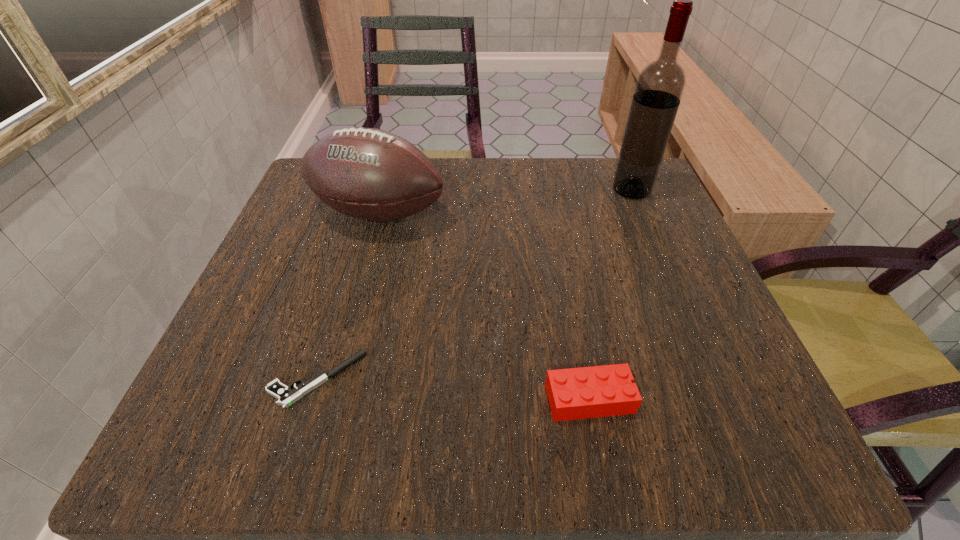
This screenshot has width=960, height=540. I want to click on empty space between the tallest object and the shortest object, so click(474, 285).

This screenshot has width=960, height=540. I want to click on vacant area that lies between the pistol and the Lego, so click(453, 389).

Identify the location of empty space that is in between the Lego and the rightmost object. (611, 294).

Locate an element on the screen. The width and height of the screenshot is (960, 540). free spot between the second object from right to left and the football (American) is located at coordinates (484, 306).

Image resolution: width=960 pixels, height=540 pixels. What are the coordinates of `empty space that is in between the second shortest object and the second tallest object` in the screenshot? It's located at (484, 306).

Find the location of a particular element. Image resolution: width=960 pixels, height=540 pixels. the third closest object to the shortest object is located at coordinates tap(660, 85).

Identify which object is the closest to the third object from left to right. Please provide its 2D coordinates. Your answer should be formatted as a tuple, i.e. [(x, y)], where the tuple contains the x and y coordinates of a point satisfying the conditions above.

[(287, 396)]

Where is `free space that satisfies the following two spatial constraints: 1. on the front side of the Lego; 2. on the right side of the football (American)`? Image resolution: width=960 pixels, height=540 pixels. free space that satisfies the following two spatial constraints: 1. on the front side of the Lego; 2. on the right side of the football (American) is located at coordinates (328, 399).

Where is `vacant space that satisfies the following two spatial constraints: 1. on the front side of the football (American); 2. on the front-facing side of the shortest object`? The width and height of the screenshot is (960, 540). vacant space that satisfies the following two spatial constraints: 1. on the front side of the football (American); 2. on the front-facing side of the shortest object is located at coordinates pyautogui.click(x=334, y=379).

What are the coordinates of `free location that satisfies the following two spatial constraints: 1. on the front-facing side of the pistol; 2. on the back side of the second shortest object` in the screenshot? It's located at (311, 399).